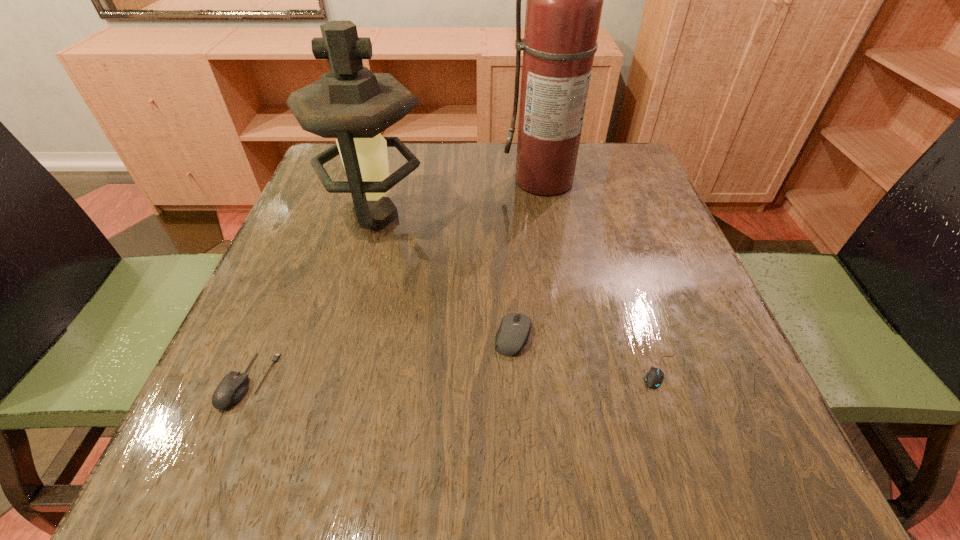
The height and width of the screenshot is (540, 960). I want to click on empty space that is in between the fire extinguisher and the fourth shortest object, so click(x=461, y=199).

Find the location of a particular element. The image size is (960, 540). empty space between the second shortest object and the second mouse from right to left is located at coordinates (381, 359).

Identify the location of vacant space that's between the second tallest mouse and the second tallest object. The width and height of the screenshot is (960, 540). (312, 299).

At what (x,y) coordinates should I click in order to perform the action: click on free space between the second mouse from right to left and the second tallest object. Please return your answer as a coordinate pair (x, y). Looking at the image, I should click on (444, 276).

This screenshot has width=960, height=540. In order to click on free space between the second shortest object and the oil lamp in this screenshot , I will do `click(312, 299)`.

You are a GUI agent. You are given a task and a screenshot of the screen. Output one action in this format:
    pyautogui.click(x=<x>, y=<y>)
    Task: Click on the free space between the shortest object and the leftmost mouse
    The image size is (960, 540).
    Given the screenshot: What is the action you would take?
    point(455,375)

Identify the location of free spot between the fire extinguisher and the oil lamp. (461, 199).

This screenshot has height=540, width=960. Find the location of `object that is the third closest to the second tallest object`. object that is the third closest to the second tallest object is located at coordinates (232, 388).

Select which object is the closest to the tallest object. Please provide its 2D coordinates. Your answer should be formatted as a tuple, i.e. [(x, y)], where the tuple contains the x and y coordinates of a point satisfying the conditions above.

[(350, 103)]

Where is `mouse that is the closest to the shortest mouse`? This screenshot has width=960, height=540. mouse that is the closest to the shortest mouse is located at coordinates (514, 330).